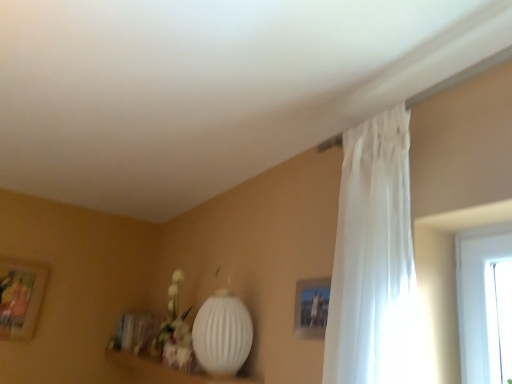
Question: From the image's perspective, is white ribbed lamp at lower center above white matte vase at lower center?

Choices:
 (A) yes
 (B) no

Answer: (A)

Question: From a real-world perspective, is white ribbed lamp at lower center below white matte vase at lower center?

Choices:
 (A) no
 (B) yes

Answer: (B)

Question: Can you confirm if white ribbed lamp at lower center is positioned to the left of white matte vase at lower center?

Choices:
 (A) yes
 (B) no

Answer: (B)

Question: Is white ribbed lamp at lower center thinner than white matte vase at lower center?

Choices:
 (A) no
 (B) yes

Answer: (A)

Question: Does white ribbed lamp at lower center have a larger size compared to white matte vase at lower center?

Choices:
 (A) yes
 (B) no

Answer: (A)

Question: From their relative heights in the image, would you say white ribbed lamp at lower center is taller or shorter than white sheer curtain at upper right?

Choices:
 (A) short
 (B) tall

Answer: (A)

Question: Visually, is white ribbed lamp at lower center positioned to the left or to the right of white sheer curtain at upper right?

Choices:
 (A) right
 (B) left

Answer: (B)

Question: Considering the positions of white ribbed lamp at lower center and white sheer curtain at upper right in the image, is white ribbed lamp at lower center wider or thinner than white sheer curtain at upper right?

Choices:
 (A) thin
 (B) wide

Answer: (B)

Question: Is white ribbed lamp at lower center in front of or behind white sheer curtain at upper right in the image?

Choices:
 (A) front
 (B) behind

Answer: (B)

Question: In terms of size, does white sheer curtain at upper right appear bigger or smaller than white matte vase at lower center?

Choices:
 (A) big
 (B) small

Answer: (A)

Question: From the image's perspective, is white sheer curtain at upper right located above or below white matte vase at lower center?

Choices:
 (A) above
 (B) below

Answer: (A)

Question: In the image, is white sheer curtain at upper right on the left side or the right side of white matte vase at lower center?

Choices:
 (A) right
 (B) left

Answer: (A)

Question: Considering their positions, is white sheer curtain at upper right located in front of or behind white matte vase at lower center?

Choices:
 (A) behind
 (B) front

Answer: (B)

Question: From the image's perspective, relative to wooden picture frame at left, is white matte vase at lower center above or below?

Choices:
 (A) above
 (B) below

Answer: (A)

Question: From a real-world perspective, is white matte vase at lower center positioned above or below wooden picture frame at left?

Choices:
 (A) above
 (B) below

Answer: (B)